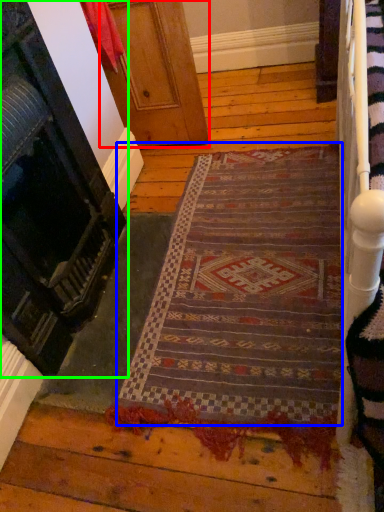
Question: Which object is the closest to the door (highlighted by a red box)? Choose among these: mat (highlighted by a blue box) or door (highlighted by a green box).

Choices:
 (A) mat
 (B) door

Answer: (B)